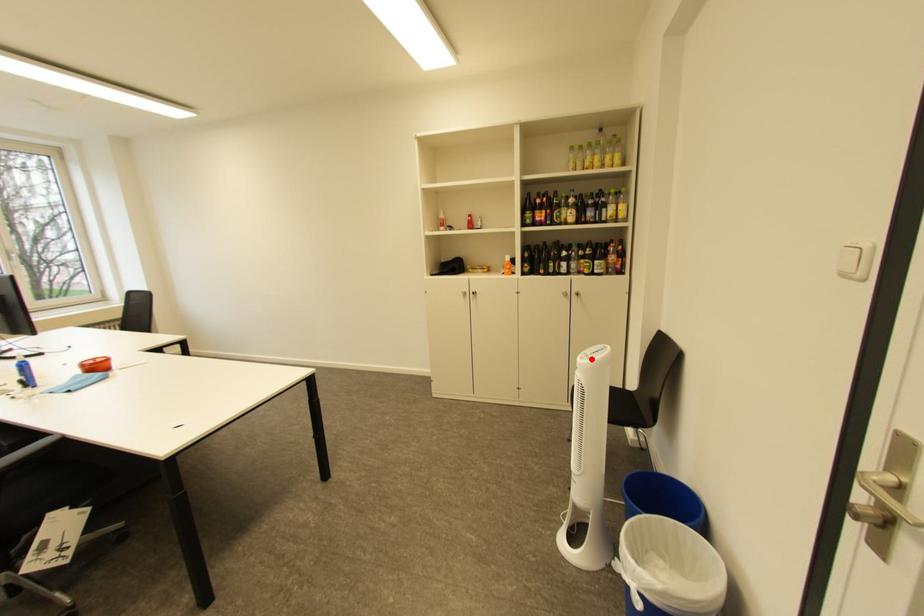
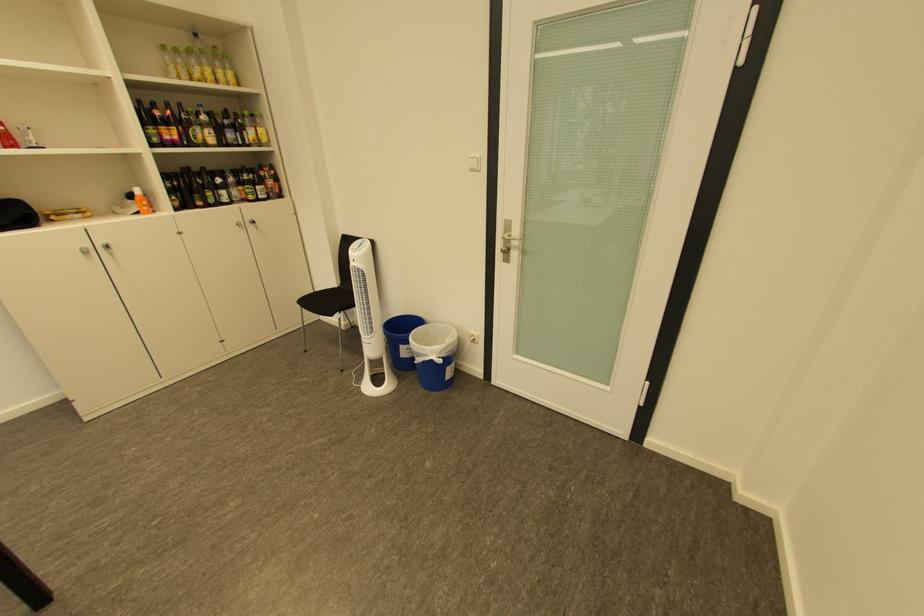
Locate, in the second image, the point that corresponds to the highlighted location in the first image.

(363, 253)